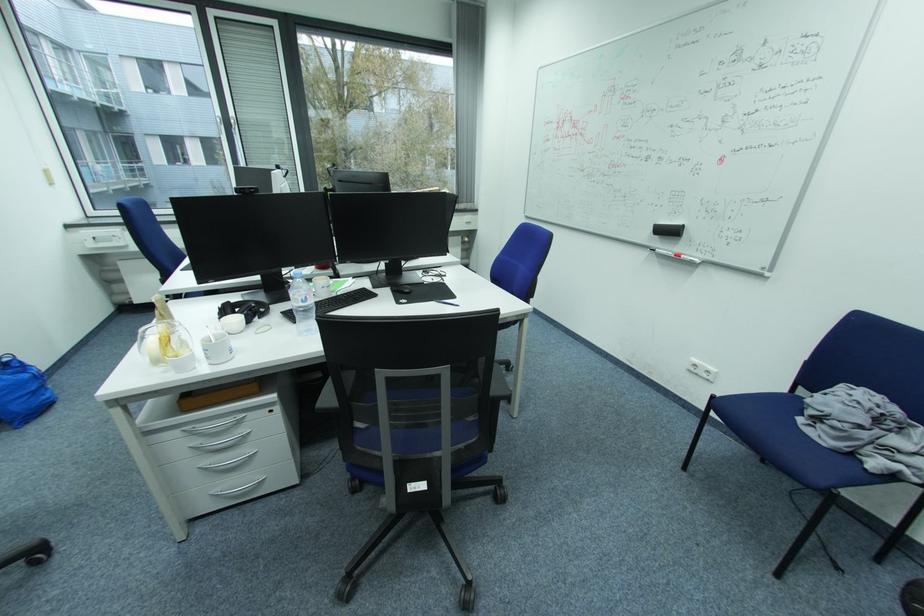
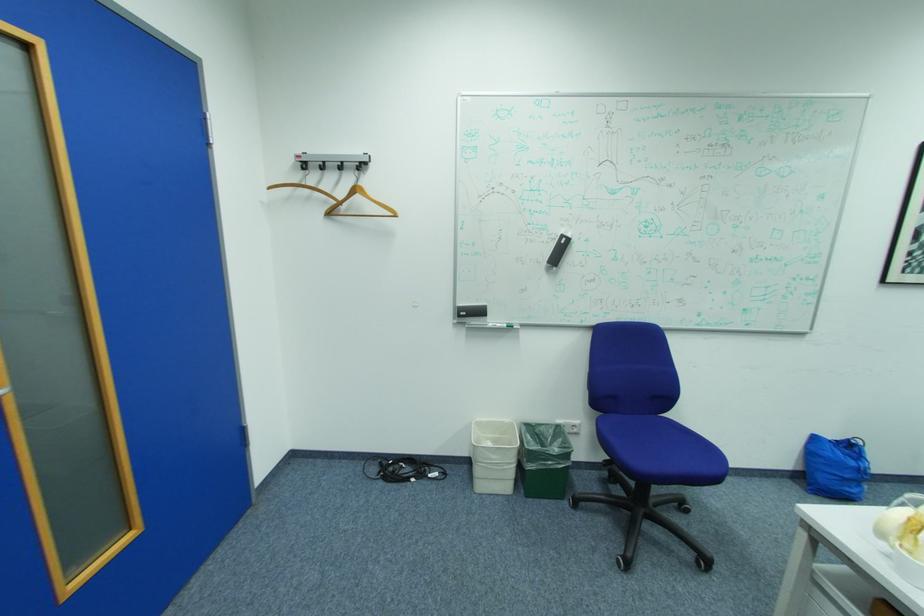
First-person continuous shooting, in which direction is the camera rotating?

The camera's rotation is toward left-down.